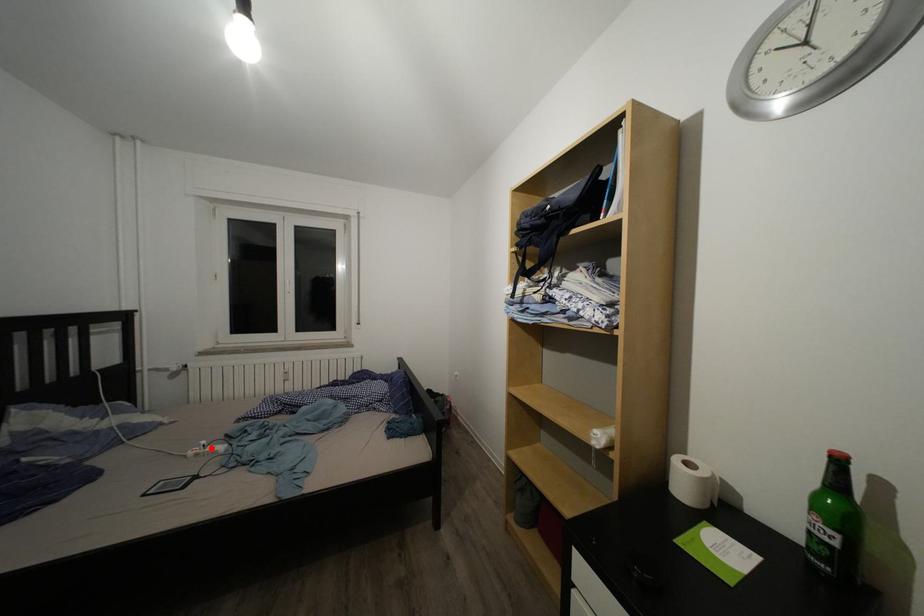
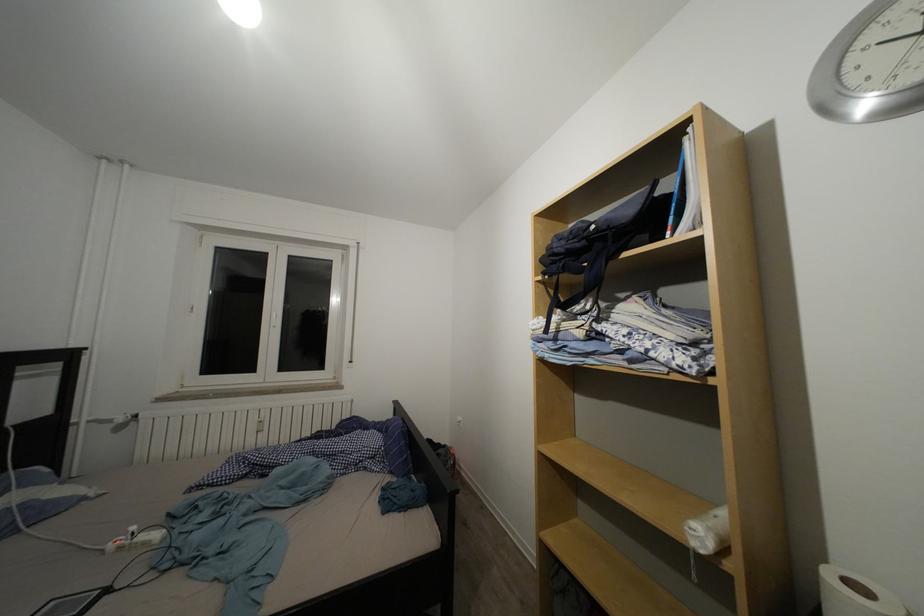
In the second image, find the point that corresponds to the highlighted location in the first image.

(140, 533)